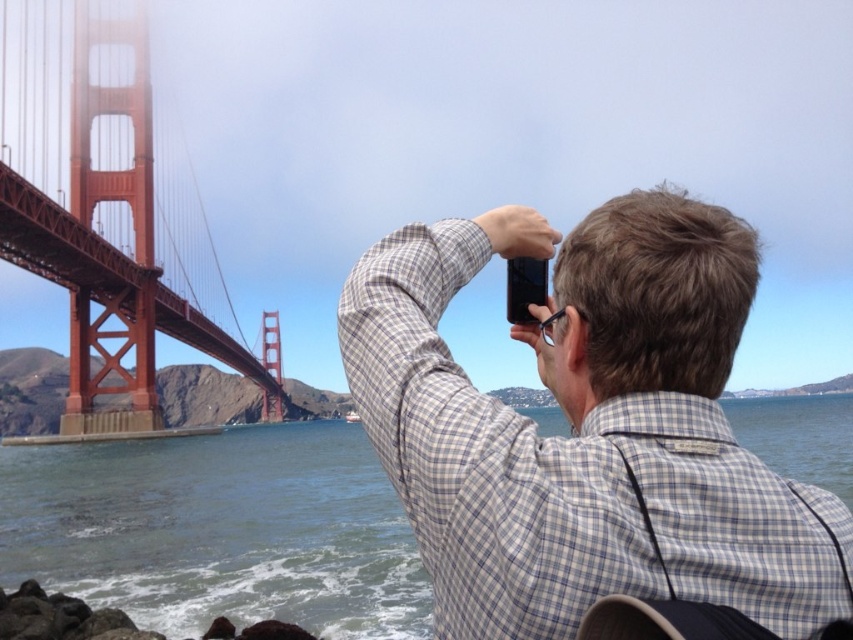
Question: Which object is closer to the camera taking this photo?

Choices:
 (A) clear blue water at lower left
 (B) red painted steel suspension bridge at left

Answer: (A)

Question: Does checkered shirt at upper right have a lesser width compared to clear blue water at lower left?

Choices:
 (A) no
 (B) yes

Answer: (B)

Question: Is clear blue water at lower left wider than red painted steel suspension bridge at left?

Choices:
 (A) yes
 (B) no

Answer: (A)

Question: Estimate the real-world distances between objects in this image. Which object is closer to the red painted steel suspension bridge at left?

Choices:
 (A) clear blue water at lower left
 (B) checkered shirt at upper right

Answer: (A)

Question: Which point is closer to the camera taking this photo?

Choices:
 (A) (76, 292)
 (B) (177, 557)

Answer: (B)

Question: Is checkered shirt at upper right closer to the viewer compared to red painted steel suspension bridge at left?

Choices:
 (A) no
 (B) yes

Answer: (B)